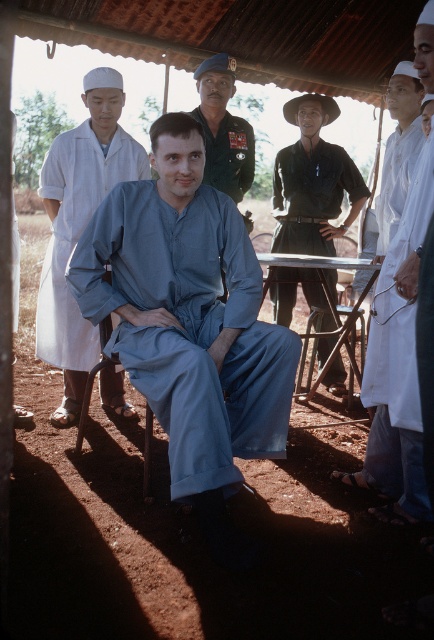
Question: Is blue cotton jumpsuit at center smaller than dark green military uniform at center?

Choices:
 (A) yes
 (B) no

Answer: (B)

Question: Does dark green uniform at center appear over metallic silver picnic table at center?

Choices:
 (A) yes
 (B) no

Answer: (A)

Question: Which point is farther to the camera?

Choices:
 (A) (377, 365)
 (B) (246, 122)

Answer: (B)

Question: Estimate the real-world distances between objects in this image. Which object is farther from the metallic silver picnic table at center?

Choices:
 (A) dark green military uniform at center
 (B) white cloth coat at right
 (C) blue cotton jumpsuit at center
 (D) matte blue jumpsuit at center

Answer: (C)

Question: Which of these objects is positioned farthest from the dark green uniform at center?

Choices:
 (A) blue cotton jumpsuit at center
 (B) dark green military uniform at center
 (C) white cloth coat at right
 (D) matte blue jumpsuit at center

Answer: (C)

Question: Is matte blue jumpsuit at center positioned before dark green military uniform at center?

Choices:
 (A) yes
 (B) no

Answer: (A)